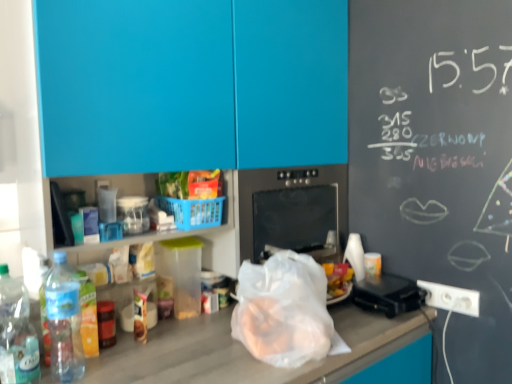
Question: Considering the relative sizes of shiny plastic bag of chips at center and black plastic toaster at right in the image provided, is shiny plastic bag of chips at center wider than black plastic toaster at right?

Choices:
 (A) no
 (B) yes

Answer: (A)

Question: Is shiny plastic bag of chips at center placed right next to black plastic toaster at right?

Choices:
 (A) yes
 (B) no

Answer: (B)

Question: Does shiny plastic bag of chips at center have a smaller size compared to black plastic toaster at right?

Choices:
 (A) no
 (B) yes

Answer: (B)

Question: Considering the relative sizes of shiny plastic bag of chips at center and black plastic toaster at right in the image provided, is shiny plastic bag of chips at center bigger than black plastic toaster at right?

Choices:
 (A) no
 (B) yes

Answer: (A)

Question: Does shiny plastic bag of chips at center have a lesser width compared to black plastic toaster at right?

Choices:
 (A) yes
 (B) no

Answer: (A)

Question: Is white plastic electric outlet at lower right to the left or to the right of black glass oven at center in the image?

Choices:
 (A) left
 (B) right

Answer: (B)

Question: From a real-world perspective, is white plastic electric outlet at lower right positioned above or below black glass oven at center?

Choices:
 (A) above
 (B) below

Answer: (B)

Question: Considering the positions of point coord(468,314) and point coord(284,231), is point coord(468,314) closer or farther from the camera than point coord(284,231)?

Choices:
 (A) closer
 (B) farther

Answer: (A)

Question: In the image, is white plastic electric outlet at lower right positioned in front of or behind black glass oven at center?

Choices:
 (A) front
 (B) behind

Answer: (B)

Question: Does point (186, 211) appear closer or farther from the camera than point (67, 304)?

Choices:
 (A) closer
 (B) farther

Answer: (B)

Question: From the image's perspective, is blue plastic basket at center above or below clear plastic bottle at lower left, the 2th bottle from the left?

Choices:
 (A) below
 (B) above

Answer: (B)

Question: Relative to clear plastic bottle at lower left, the first bottle when ordered from right to left, is blue plastic basket at center in front or behind?

Choices:
 (A) behind
 (B) front

Answer: (A)

Question: Is blue plastic basket at center wider or thinner than clear plastic bottle at lower left, the 2th bottle from the left?

Choices:
 (A) wide
 (B) thin

Answer: (A)

Question: Is transparent plastic bag at center bigger or smaller than clear plastic bottle at lower left, the first bottle when ordered from right to left?

Choices:
 (A) small
 (B) big

Answer: (B)

Question: From the image's perspective, is transparent plastic bag at center positioned above or below clear plastic bottle at lower left, the 2th bottle from the left?

Choices:
 (A) above
 (B) below

Answer: (A)